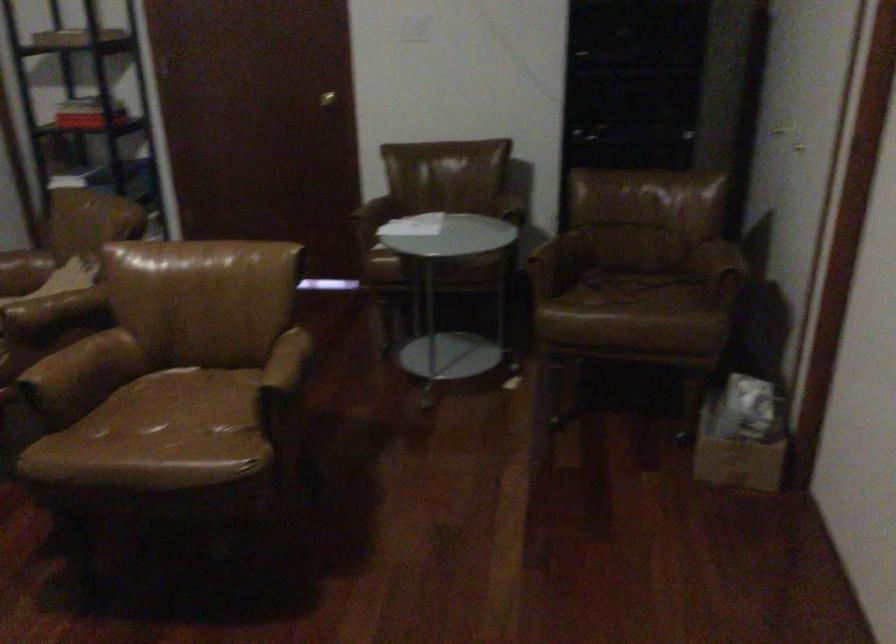
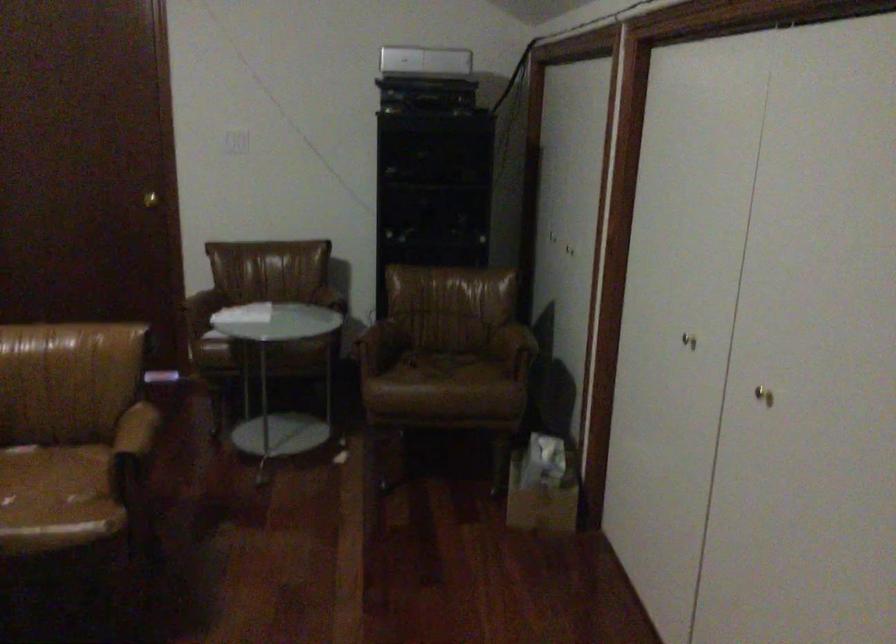
The images are taken continuously from a first-person perspective. In which direction are you moving?

The movement direction of the cameraman is left, backward.